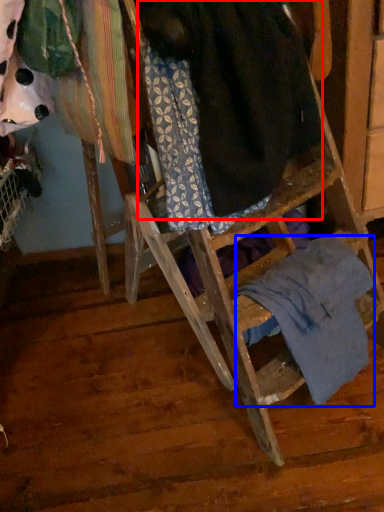
Question: Which object appears closest to the camera in this image, wool (highlighted by a red box) or underclothes (highlighted by a blue box)?

Choices:
 (A) wool
 (B) underclothes

Answer: (A)